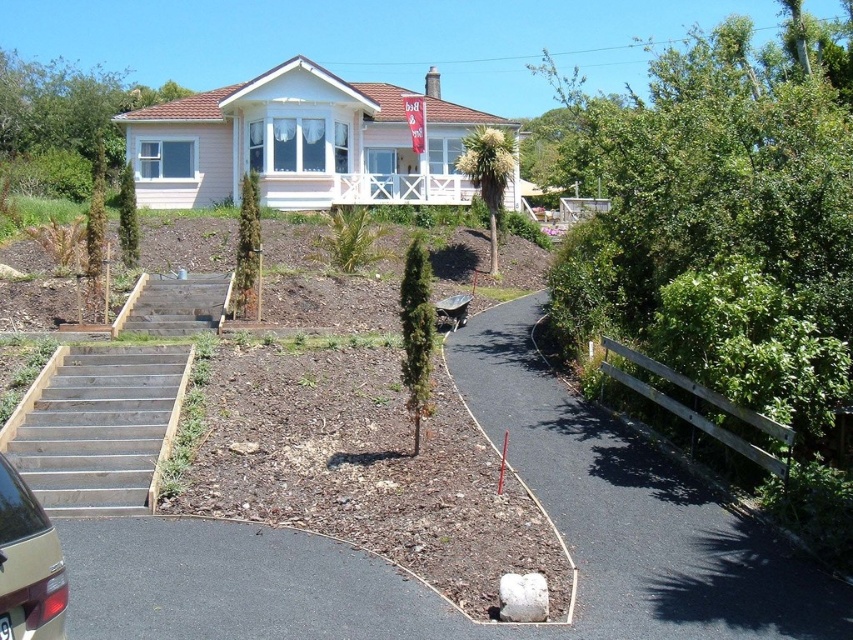
Which is below, black asphalt driveway at center or metallic gold car at lower left?

Positioned lower is black asphalt driveway at center.

Looking at this image, is black asphalt driveway at center wider than metallic gold car at lower left?

Yes, black asphalt driveway at center is wider than metallic gold car at lower left.

Is point (679, 618) less distant than point (20, 612)?

No, it is behind (20, 612).

Locate an element on the screen. This screenshot has height=640, width=853. black asphalt driveway at center is located at coordinates (631, 513).

Between point (712, 618) and point (117, 499), which one is positioned behind?

Positioned behind is point (117, 499).

Between black asphalt driveway at center and wooden stairs at lower left, which one has less height?

With less height is wooden stairs at lower left.

Which is in front, point (469, 339) or point (91, 452)?

Positioned in front is point (91, 452).

The width and height of the screenshot is (853, 640). What are the coordinates of `black asphalt driveway at center` in the screenshot? It's located at (631, 513).

Which of these two, wooden stairs at lower left or brown wooden stairs at lower left, stands taller?

wooden stairs at lower left is taller.

Who is more distant from viewer, (160, 346) or (149, 310)?

Positioned behind is point (149, 310).

Which is behind, point (134, 401) or point (142, 276)?

Positioned behind is point (142, 276).

The width and height of the screenshot is (853, 640). Find the location of `wooden stairs at lower left`. wooden stairs at lower left is located at coordinates point(102,428).